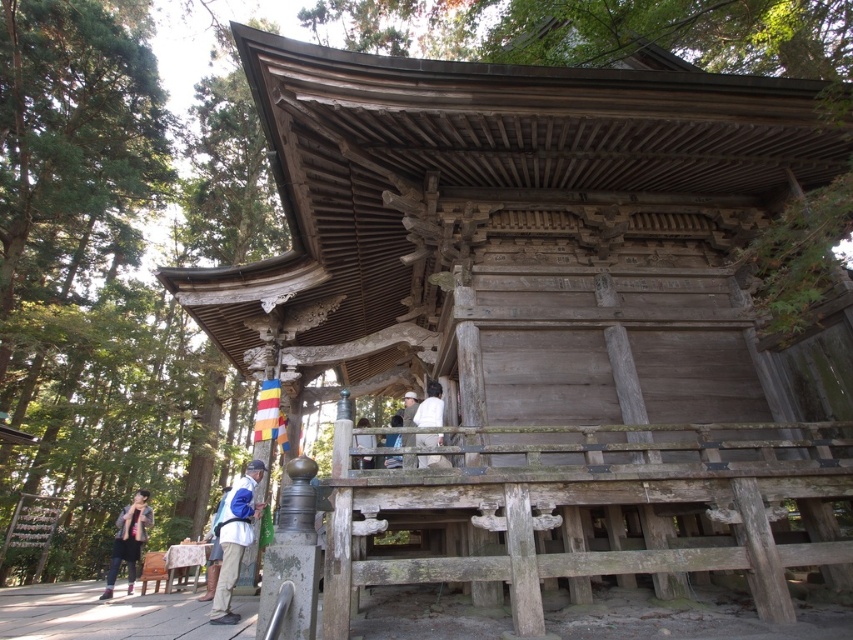
Question: Considering the relative positions of white fabric at center and white fabric bag at center in the image provided, where is white fabric at center located with respect to white fabric bag at center?

Choices:
 (A) above
 (B) below

Answer: (A)

Question: Does white fabric bag at lower center have a larger size compared to white fabric at center?

Choices:
 (A) no
 (B) yes

Answer: (A)

Question: Based on their relative distances, which object is farther from the denim jacket at lower left?

Choices:
 (A) white fabric bag at lower center
 (B) white fabric at center
 (C) white fabric bag at center

Answer: (B)

Question: Which point is farther to the camera?

Choices:
 (A) (223, 538)
 (B) (416, 436)
 (C) (144, 492)
 (D) (370, 436)

Answer: (C)

Question: Which point is farther to the camera?

Choices:
 (A) (115, 561)
 (B) (428, 420)
 (C) (228, 586)

Answer: (A)

Question: Does denim jacket at lower left appear on the left side of white fabric bag at center?

Choices:
 (A) yes
 (B) no

Answer: (A)